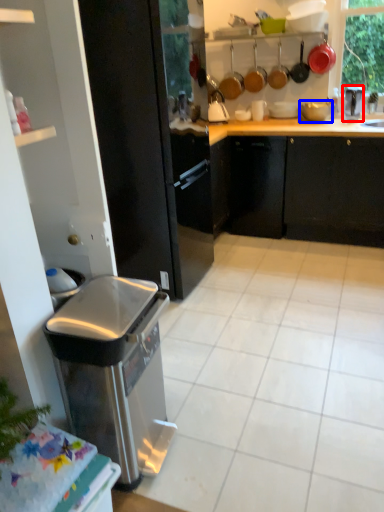
Question: Which point is closer to the camera, appliance (highlighted by a red box) or appliance (highlighted by a blue box)?

Choices:
 (A) appliance
 (B) appliance

Answer: (A)